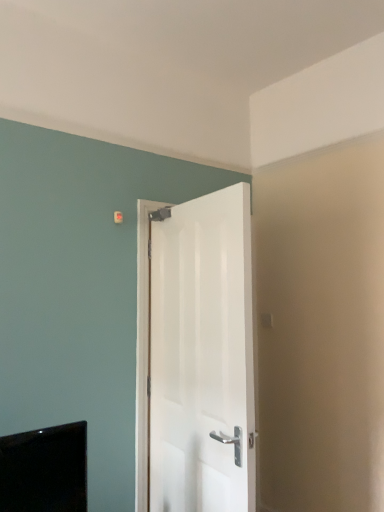
This screenshot has width=384, height=512. Find the location of `white glossy door at center`. white glossy door at center is located at coordinates (196, 356).

Image resolution: width=384 pixels, height=512 pixels. What do you see at coordinates (196, 356) in the screenshot?
I see `white glossy door at center` at bounding box center [196, 356].

Identify the location of white glossy door at center. (196, 356).